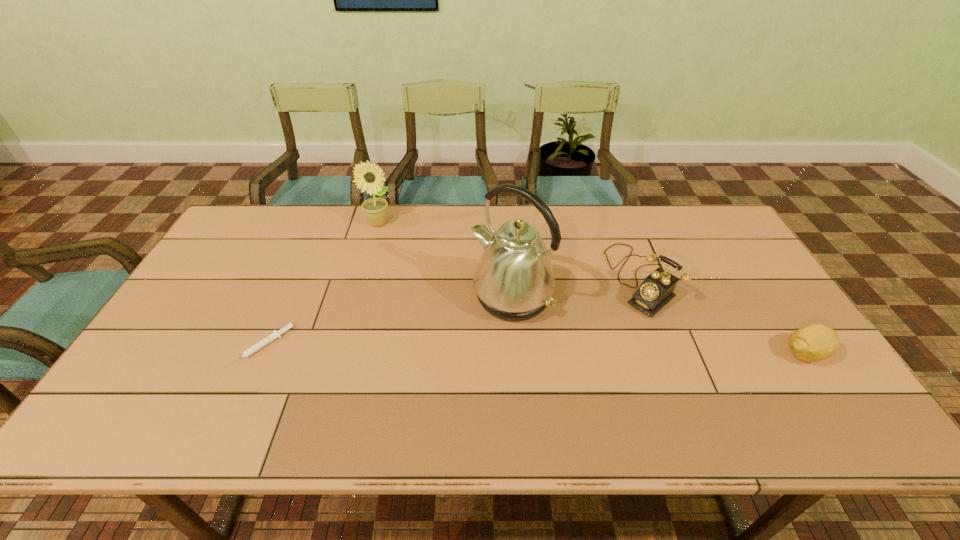
This screenshot has width=960, height=540. Identify the location of free space on the desktop that is between the shortest object and the lemon and is positioned on the face of the second tallest object. (475, 349).

Identify the location of vacant space on the desktop that is between the syringe and the fourth tallest object and is positioned on the dial of the fourth object from left to right. (553, 350).

Locate an element on the screen. vacant spot on the desktop that is between the leftmost object and the second shortest object and is positioned from the spout of the tallest object is located at coordinates (457, 349).